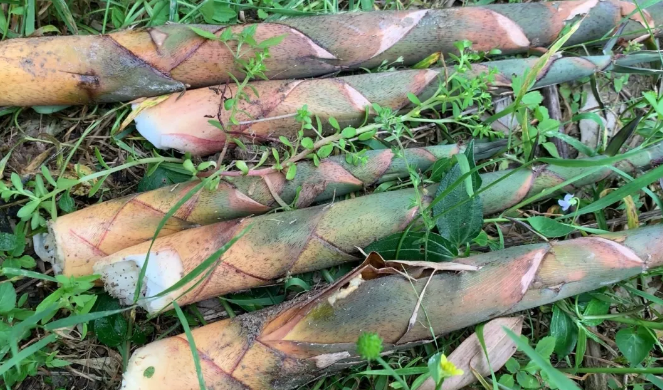
This screenshot has height=390, width=663. I want to click on far left plant, so click(x=303, y=43).